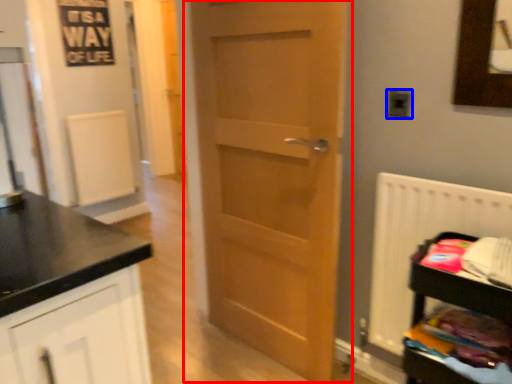
Question: Which object is further to the camera taking this photo, door (highlighted by a red box) or electric outlet (highlighted by a blue box)?

Choices:
 (A) door
 (B) electric outlet

Answer: (B)